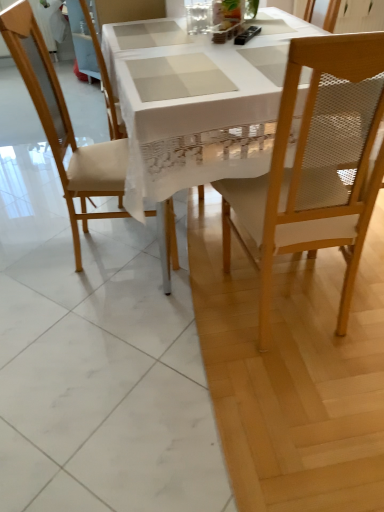
This screenshot has height=512, width=384. Find the location of `free location in front of white lace tablecloth at center`. free location in front of white lace tablecloth at center is located at coordinates (185, 383).